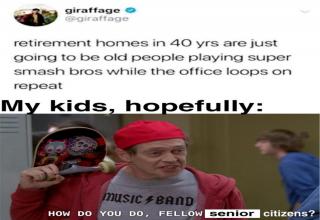
You are a GUI agent. You are given a task and a screenshot of the screen. Output one action in this format:
    pyautogui.click(x=<x>, y=<y>)
    Task: Click on the homes
    
    Given the screenshot: What is the action you would take?
    pyautogui.click(x=127, y=40)